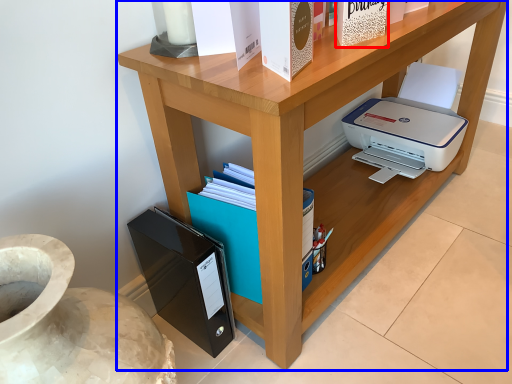
Question: Which object appears closest to the camera in this image, paperback book (highlighted by a red box) or desk (highlighted by a blue box)?

Choices:
 (A) paperback book
 (B) desk

Answer: (B)